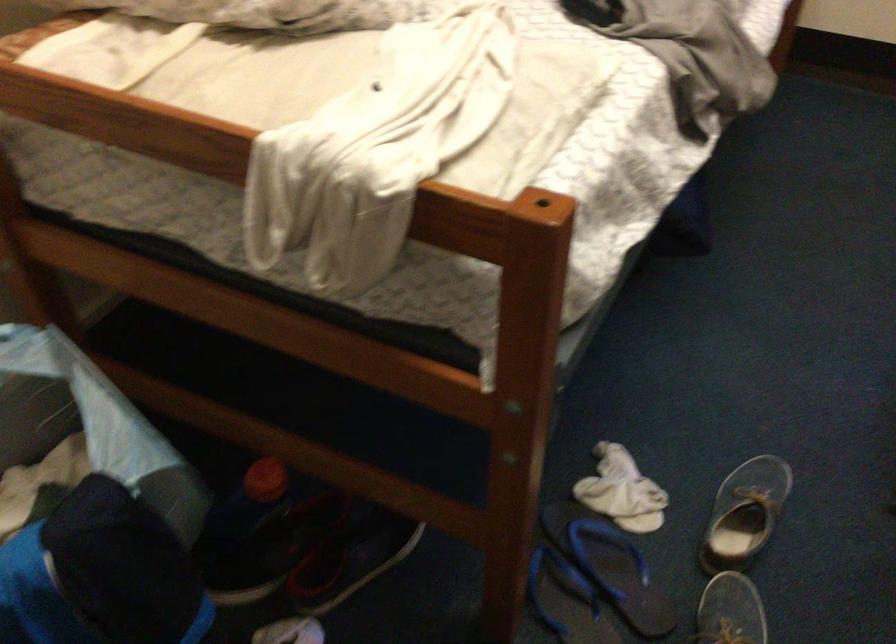
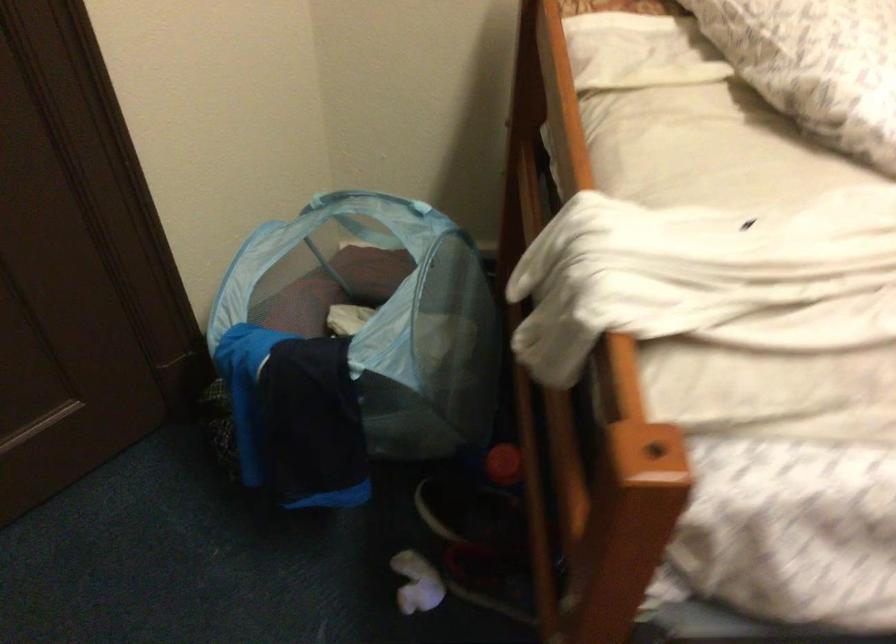
In the second image, find the point that corresponds to pixel 264 545 in the first image.

(469, 509)